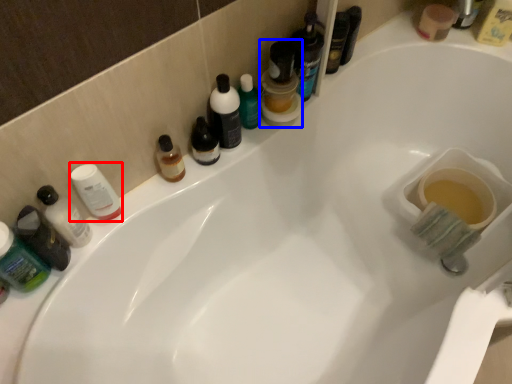
Question: Which object appears closest to the camera in this image, toiletry (highlighted by a red box) or mouthwash (highlighted by a blue box)?

Choices:
 (A) toiletry
 (B) mouthwash

Answer: (A)